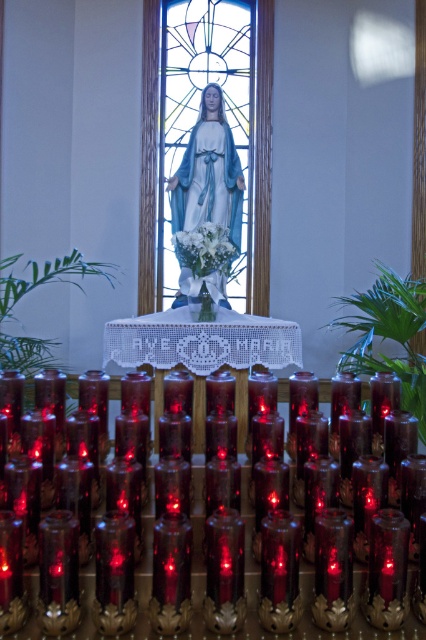
Does stained glass window at center appear on the left side of translucent glass candle at lower center?

Indeed, stained glass window at center is positioned on the left side of translucent glass candle at lower center.

Looking at this image, is stained glass window at center taller than translucent glass candle at lower center?

Correct, stained glass window at center is much taller as translucent glass candle at lower center.

Between point (233, 154) and point (365, 572), which one is positioned in front?

Point (365, 572) is more forward.

I want to click on stained glass window at center, so (x=199, y=118).